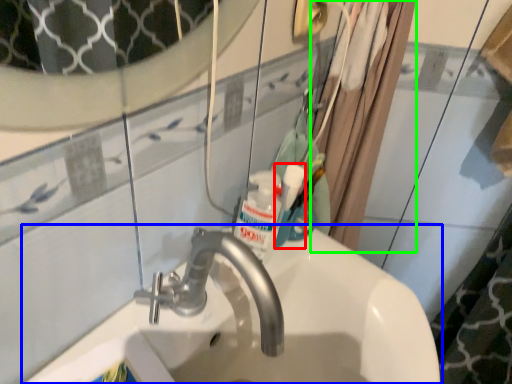
Question: Based on their relative distances, which object is farther from mouthwash (highlighted by a red box)? Choose from sink (highlighted by a blue box) and shower curtain (highlighted by a green box).

Choices:
 (A) sink
 (B) shower curtain

Answer: (B)